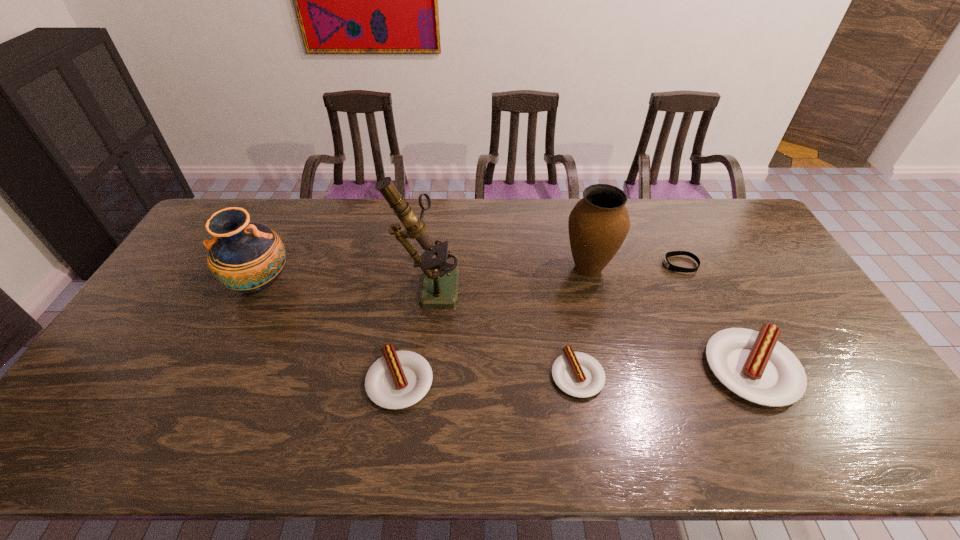
Where is `free region that satisfies the following two spatial constraints: 1. at the eyepiece of the microscope; 2. on the right side of the sixth tallest object`? This screenshot has width=960, height=540. free region that satisfies the following two spatial constraints: 1. at the eyepiece of the microscope; 2. on the right side of the sixth tallest object is located at coordinates (417, 375).

Identify the location of blank space that satisfies the following two spatial constraints: 1. on the back side of the tallest sausage; 2. on the display of the wristband. (698, 265).

At what (x,y) coordinates should I click in order to perform the action: click on vacant space that satisfies the following two spatial constraints: 1. on the back side of the second tallest sausage; 2. on the right side of the tallest sausage. Please return your answer as a coordinate pair (x, y). The width and height of the screenshot is (960, 540). Looking at the image, I should click on (401, 369).